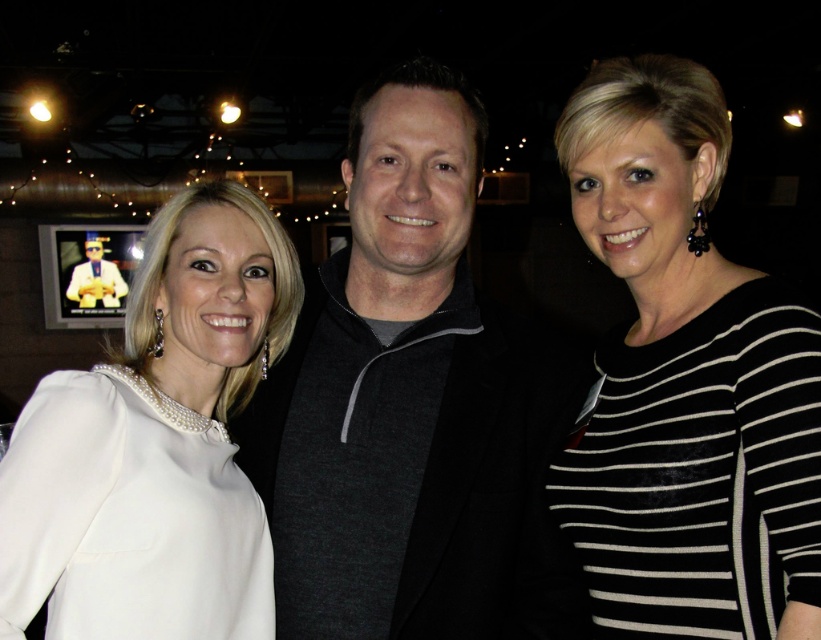
Can you confirm if dark gray sweater at center is positioned below white satin dress at center?

No.

Is dark gray sweater at center shorter than white satin dress at center?

No.

Between point (388, 436) and point (131, 321), which one is positioned behind?

Point (131, 321)

Locate an element on the screen. This screenshot has width=821, height=640. dark gray sweater at center is located at coordinates pyautogui.click(x=406, y=401).

Which is below, dark gray sweater at center or black striped shirt at center?

dark gray sweater at center

Between point (363, 220) and point (790, 442), which one is positioned behind?

Point (363, 220)

Where is `dark gray sweater at center`? The height and width of the screenshot is (640, 821). dark gray sweater at center is located at coordinates (406, 401).

What do you see at coordinates (686, 381) in the screenshot? Image resolution: width=821 pixels, height=640 pixels. I see `black striped shirt at center` at bounding box center [686, 381].

Where is `black striped shirt at center`? The width and height of the screenshot is (821, 640). black striped shirt at center is located at coordinates (686, 381).